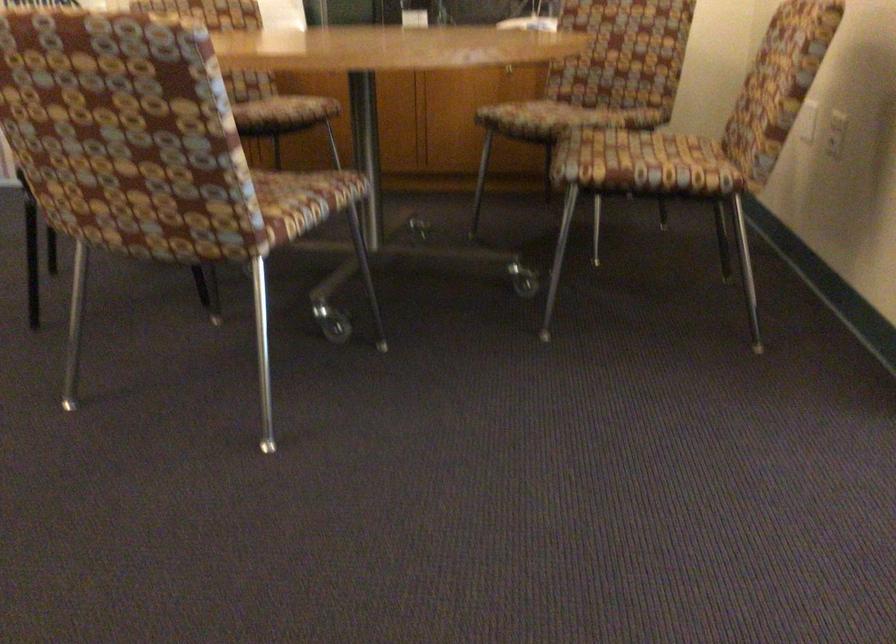
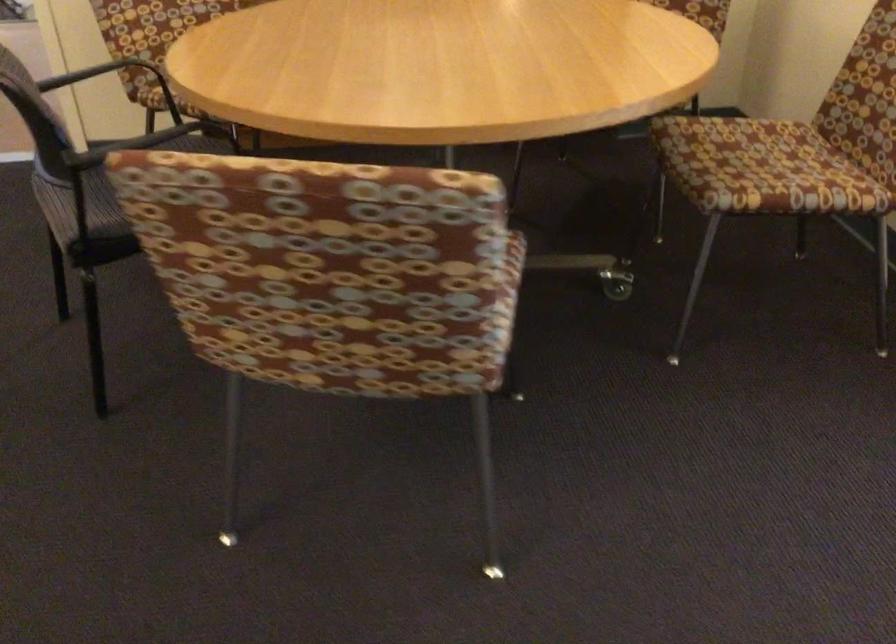
Question: The first image is from the beginning of the video and the second image is from the end. How did the camera likely rotate when shooting the video?

Choices:
 (A) Left
 (B) Right
 (C) Up
 (D) Down

Answer: (D)